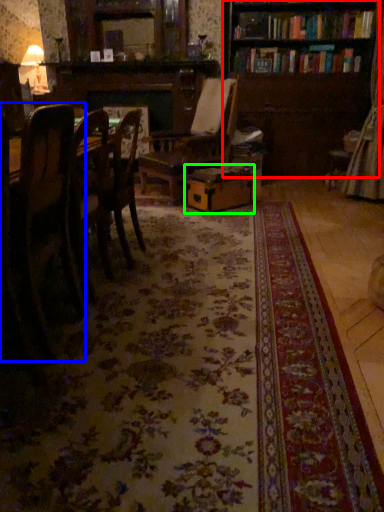
Question: Considering the real-world distances, which object is farthest from bookcase (highlighted by a red box)? chair (highlighted by a blue box) or cardboard box (highlighted by a green box)?

Choices:
 (A) chair
 (B) cardboard box

Answer: (A)